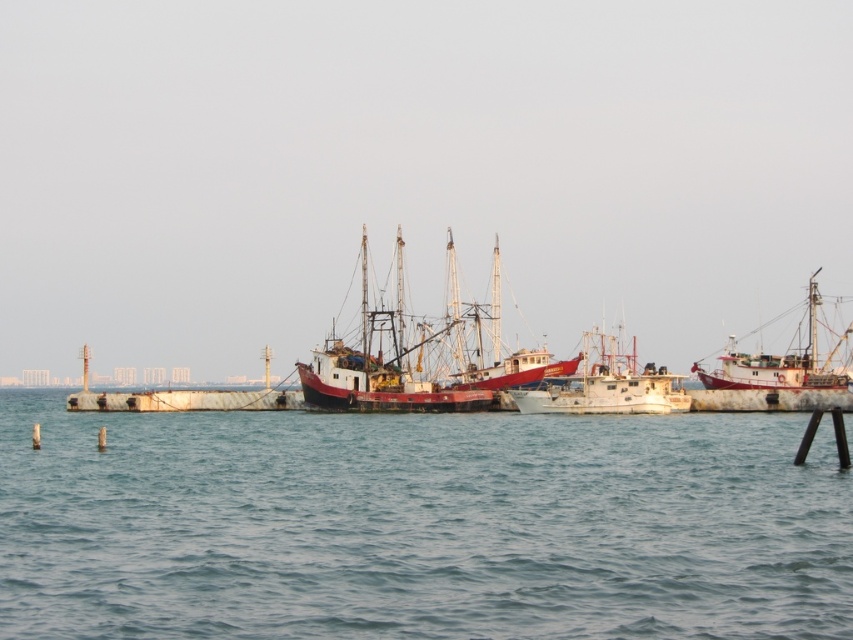
Question: Which point appears closest to the camera in this image?

Choices:
 (A) 454,268
 (B) 677,404

Answer: (B)

Question: Which of these objects is positioned farthest from the white matte fishing boat at right?

Choices:
 (A) blue water at center
 (B) rustic wooden fishing boat at center
 (C) white matte boat at center

Answer: (A)

Question: Can you confirm if blue water at center is positioned to the left of rustic wooden fishing boat at center?

Choices:
 (A) yes
 (B) no

Answer: (B)

Question: Is blue water at center thinner than white matte boat at center?

Choices:
 (A) yes
 (B) no

Answer: (B)

Question: Where is blue water at center located in relation to rustic wooden fishing boat at center in the image?

Choices:
 (A) below
 (B) above

Answer: (A)

Question: Considering the real-world distances, which object is closest to the blue water at center?

Choices:
 (A) rustic wooden fishing boat at center
 (B) white matte fishing boat at right
 (C) white matte boat at center

Answer: (C)